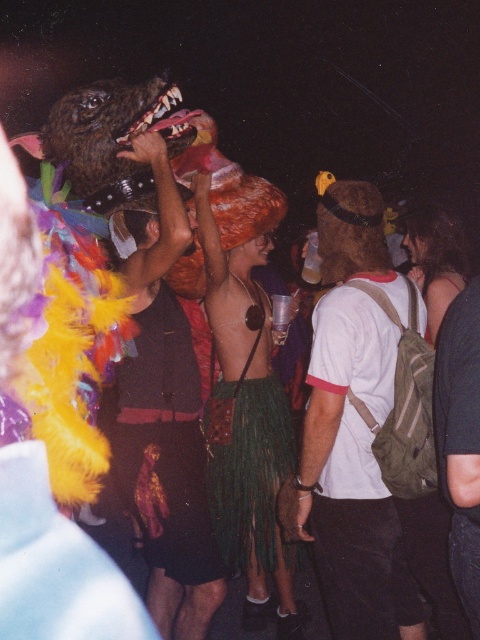
Question: Does white matte t-shirt at center lie behind fuzzy costume at center?

Choices:
 (A) yes
 (B) no

Answer: (B)

Question: Is white matte t-shirt at center in front of fuzzy costume at center?

Choices:
 (A) yes
 (B) no

Answer: (A)

Question: Among these points, which one is farthest from the camera?

Choices:
 (A) (359, 296)
 (B) (226, 392)

Answer: (B)

Question: Does white matte t-shirt at center lie in front of green fringed skirt at center?

Choices:
 (A) no
 (B) yes

Answer: (B)

Question: Considering the real-world distances, which object is farthest from the green fringed skirt at center?

Choices:
 (A) white matte t-shirt at center
 (B) fuzzy costume at center

Answer: (A)

Question: Which object is the closest to the green fringed skirt at center?

Choices:
 (A) fuzzy costume at center
 (B) white matte t-shirt at center

Answer: (A)